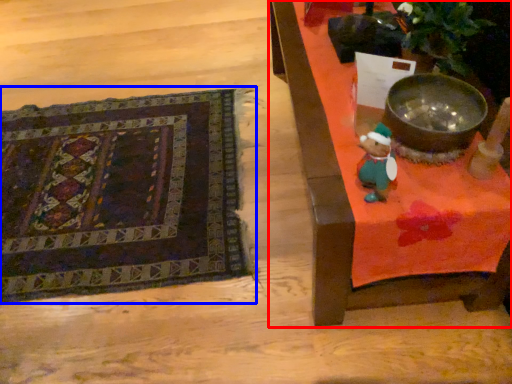
Question: Which object is closer to the camera taking this photo, furniture (highlighted by a red box) or mat (highlighted by a blue box)?

Choices:
 (A) furniture
 (B) mat

Answer: (A)